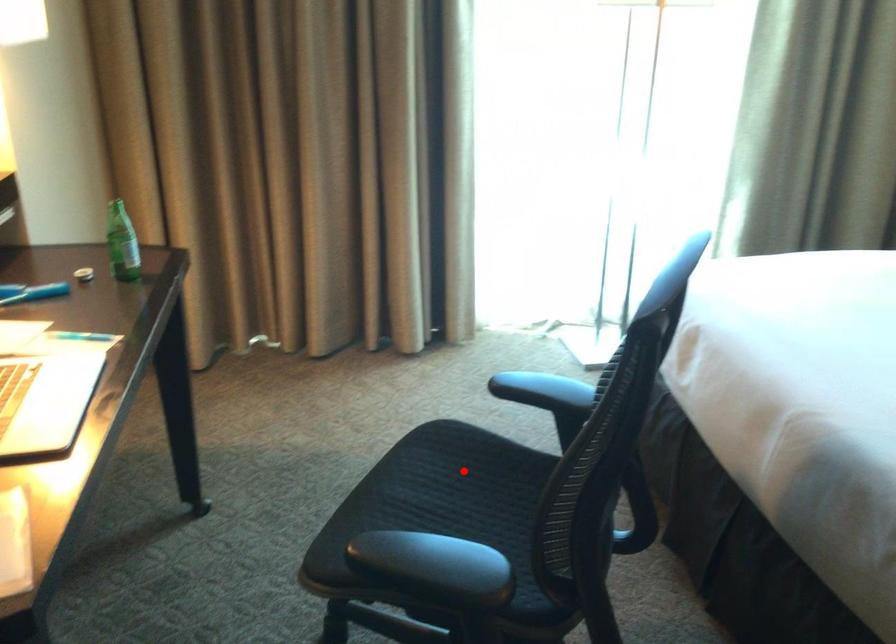
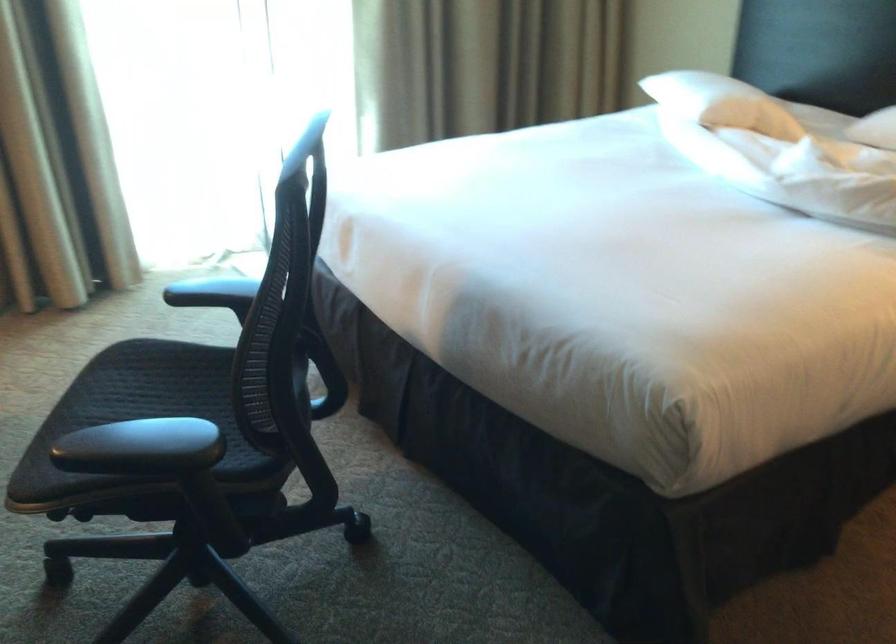
Where in the second image is the point corresponding to the highlighted location from the first image?

(159, 379)